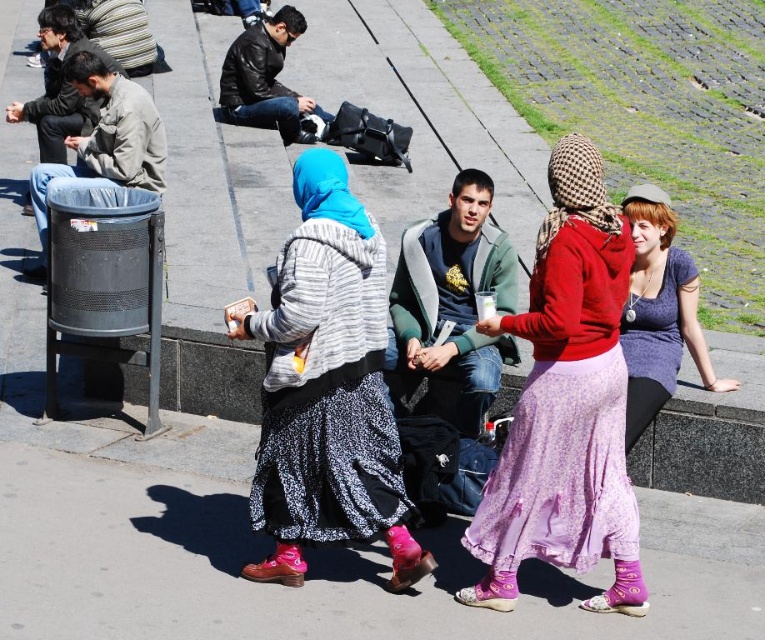
You are standing at the origin of the coordinate system in the image. A red hoodie is located at point (565,404). If you want to walk directly to the red hoodie, which direction should you move? Please answer with either north, south, east, or west.

The point (565,404) is at the center, so you should move north to reach the red hoodie.

You are a photographer trying to capture a photo of the two women in the foreground. You notice the matte red hoodie at center and the blue fabric headscarf at center in your frame. Which object should you adjust your camera angle to focus on first if you want to prioritize the one that is lower in the image?

The matte red hoodie at center is below the blue fabric headscarf at center, so you should focus on the matte red hoodie at center first since it is lower in the image.

You are a photographer trying to capture the blue fabric headscarf at center and the black leather jacket at upper center in the same frame. Based on their positions, which object should you focus on first to ensure both are in focus?

The blue fabric headscarf at center is in front of the black leather jacket at upper center, so you should focus on the blue fabric headscarf at center first to ensure both are in focus.